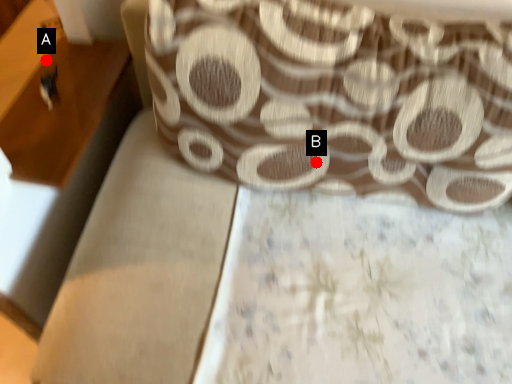
Question: Two points are circled on the image, labeled by A and B beside each circle. Which point is closer to the camera?

Choices:
 (A) A is closer
 (B) B is closer

Answer: (B)